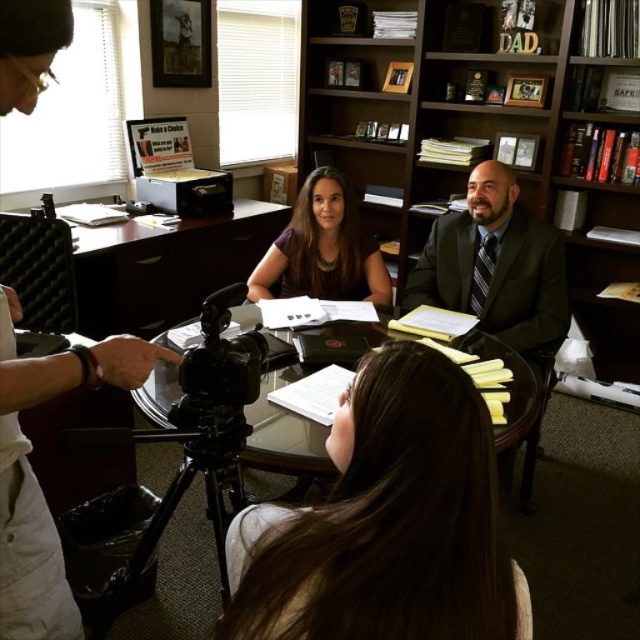
The image size is (640, 640). Find the location of `brown hair at center`. brown hair at center is located at coordinates (387, 522).

Is point (452, 561) positioned in front of point (218, 456)?

Yes, point (452, 561) is closer to viewer.

Which is behind, point (481, 515) or point (157, 442)?

Positioned behind is point (157, 442).

Locate an element on the screen. The width and height of the screenshot is (640, 640). brown hair at center is located at coordinates (387, 522).

Can you confirm if white plastic camera at left is positioned to the right of dark suit at center?

In fact, white plastic camera at left is to the left of dark suit at center.

Does white plastic camera at left have a smaller size compared to dark suit at center?

Yes.

The image size is (640, 640). Identify the location of white plastic camera at left. (35, 477).

Is point (394, 4) closer to camera compared to point (29, 570)?

No, it is not.

Who is more forward, [552,211] or [109,380]?

Point [109,380] is in front.

Locate an element on the screen. The width and height of the screenshot is (640, 640). wooden bookshelf at upper center is located at coordinates (476, 136).